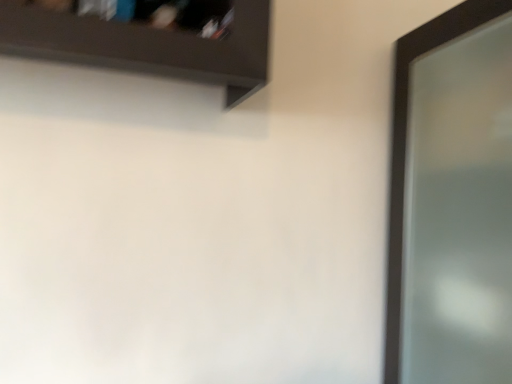
Where is `dark brown wooden shelf at upper left`? This screenshot has height=384, width=512. dark brown wooden shelf at upper left is located at coordinates (148, 38).

Describe the element at coordinates (148, 38) in the screenshot. Image resolution: width=512 pixels, height=384 pixels. I see `dark brown wooden shelf at upper left` at that location.

Locate an element on the screen. The height and width of the screenshot is (384, 512). clear glass screen door at right is located at coordinates (452, 200).

Describe the element at coordinates (452, 200) in the screenshot. I see `clear glass screen door at right` at that location.

The image size is (512, 384). I want to click on dark brown wooden shelf at upper left, so click(x=148, y=38).

In the image, is clear glass screen door at right on the left side or the right side of dark brown wooden shelf at upper left?

clear glass screen door at right is to the right of dark brown wooden shelf at upper left.

Considering the positions of objects clear glass screen door at right and dark brown wooden shelf at upper left in the image provided, who is in front, clear glass screen door at right or dark brown wooden shelf at upper left?

Positioned in front is dark brown wooden shelf at upper left.

Which is in front, point (426, 269) or point (224, 55)?

The point (224, 55) is more forward.

From the image's perspective, which is below, clear glass screen door at right or dark brown wooden shelf at upper left?

clear glass screen door at right.

From a real-world perspective, which object stands above the other?

dark brown wooden shelf at upper left.

Which of these two, clear glass screen door at right or dark brown wooden shelf at upper left, is wider?

clear glass screen door at right is wider.

Considering the sizes of objects clear glass screen door at right and dark brown wooden shelf at upper left in the image provided, who is taller, clear glass screen door at right or dark brown wooden shelf at upper left?

Standing taller between the two is clear glass screen door at right.

Looking at this image, is clear glass screen door at right bigger or smaller than dark brown wooden shelf at upper left?

clear glass screen door at right is bigger than dark brown wooden shelf at upper left.

Is clear glass screen door at right located outside dark brown wooden shelf at upper left?

Yes, clear glass screen door at right is outside of dark brown wooden shelf at upper left.

Looking at this image, would you consider clear glass screen door at right to be distant from dark brown wooden shelf at upper left?

No.

Is clear glass screen door at right oriented away from dark brown wooden shelf at upper left?

No, clear glass screen door at right is not facing the opposite direction of dark brown wooden shelf at upper left.

Measure the distance between clear glass screen door at right and dark brown wooden shelf at upper left.

clear glass screen door at right and dark brown wooden shelf at upper left are 25.28 inches apart from each other.

Find the location of `shelf in front of the clear glass screen door at right`. shelf in front of the clear glass screen door at right is located at coordinates (148, 38).

Based on their positions, is dark brown wooden shelf at upper left located to the left or right of clear glass screen door at right?

Based on their positions, dark brown wooden shelf at upper left is located to the left of clear glass screen door at right.

Is dark brown wooden shelf at upper left in front of clear glass screen door at right?

Yes, it is in front of clear glass screen door at right.

Considering the points (140, 42) and (429, 69), which point is in front, point (140, 42) or point (429, 69)?

The point (140, 42) is closer to the camera.

From the image's perspective, which is below, dark brown wooden shelf at upper left or clear glass screen door at right?

clear glass screen door at right.

From a real-world perspective, is dark brown wooden shelf at upper left positioned above or below clear glass screen door at right?

In terms of real-world spatial position, dark brown wooden shelf at upper left is above clear glass screen door at right.

In terms of width, does dark brown wooden shelf at upper left look wider or thinner when compared to clear glass screen door at right?

Considering their sizes, dark brown wooden shelf at upper left looks slimmer than clear glass screen door at right.

Which of these two, dark brown wooden shelf at upper left or clear glass screen door at right, stands shorter?

Standing shorter between the two is dark brown wooden shelf at upper left.

Is dark brown wooden shelf at upper left bigger than clear glass screen door at right?

No, dark brown wooden shelf at upper left is not bigger than clear glass screen door at right.

In the scene shown: Does dark brown wooden shelf at upper left contain clear glass screen door at right?

No, clear glass screen door at right is located outside of dark brown wooden shelf at upper left.

Is dark brown wooden shelf at upper left with clear glass screen door at right?

There is a gap between dark brown wooden shelf at upper left and clear glass screen door at right.

Is dark brown wooden shelf at upper left aimed at clear glass screen door at right?

No, dark brown wooden shelf at upper left is not oriented towards clear glass screen door at right.

Where is `shelf to the left of clear glass screen door at right`? This screenshot has width=512, height=384. shelf to the left of clear glass screen door at right is located at coordinates (148, 38).

At what (x,y) coordinates should I click in order to perform the action: click on screen door that appears below the dark brown wooden shelf at upper left (from the image's perspective). Please return your answer as a coordinate pair (x, y). The image size is (512, 384). Looking at the image, I should click on (452, 200).

This screenshot has height=384, width=512. In order to click on shelf located on the left of clear glass screen door at right in this screenshot , I will do `click(148, 38)`.